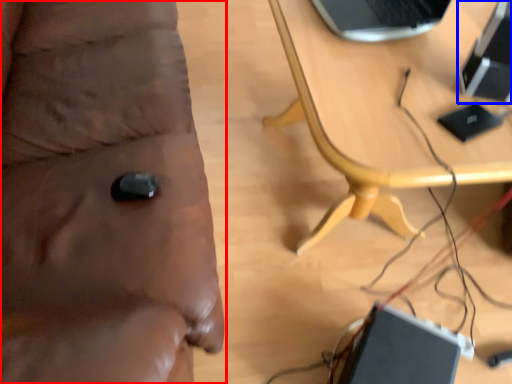
Question: Which of the following is the farthest to the observer, furniture (highlighted by a red box) or computer (highlighted by a blue box)?

Choices:
 (A) furniture
 (B) computer

Answer: (B)